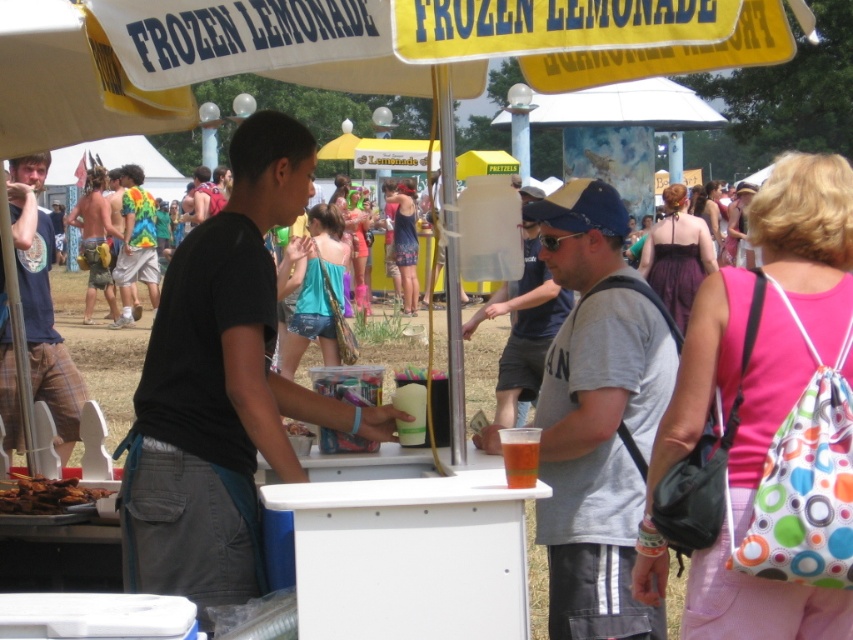
You are standing at the vendor stand and want to reach the point labeled as point [540,332]. Which direction should you move relative to the point labeled as point [502,444]?

You should move behind the point labeled as point [502,444] to reach the point labeled as point [540,332] since it is located behind it according to the spatial description.